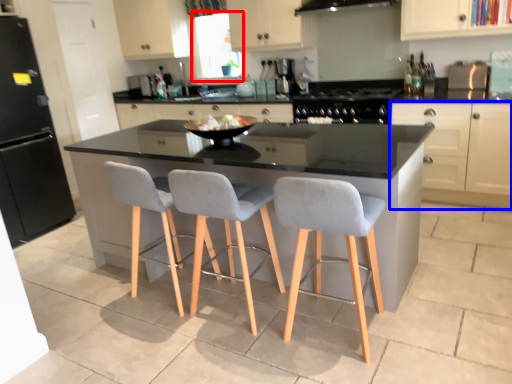
Question: Which point is closer to the camera, window screen (highlighted by a red box) or cabinetry (highlighted by a blue box)?

Choices:
 (A) window screen
 (B) cabinetry

Answer: (B)